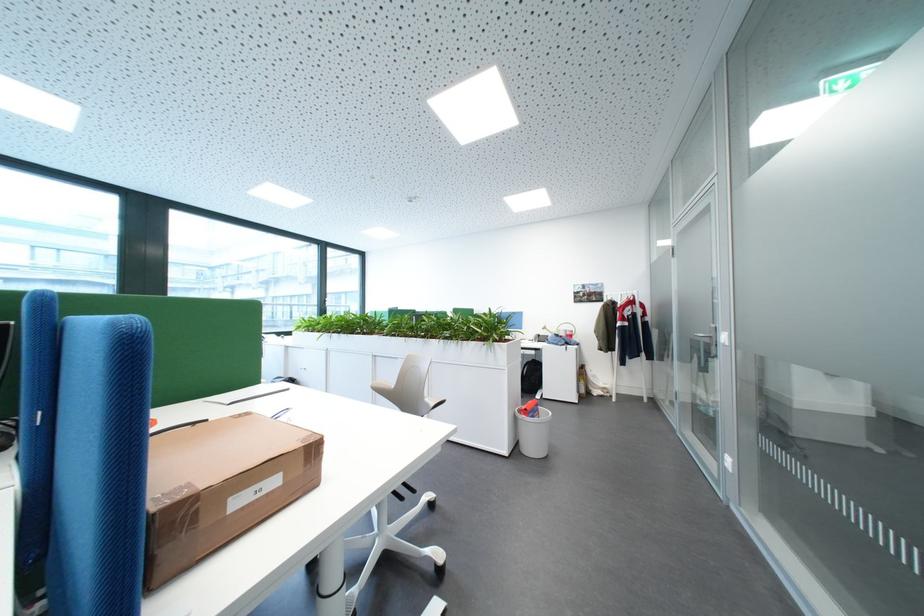
You are a GUI agent. You are given a task and a screenshot of the screen. Output one action in this format:
    pyautogui.click(x=<x>, y=<y>)
    Task: Click on the white trash can
    
    Given the screenshot: What is the action you would take?
    pyautogui.click(x=532, y=431)